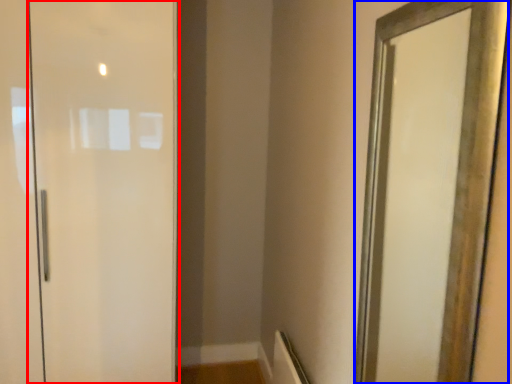
Question: Which object is further to the camera taking this photo, door (highlighted by a red box) or mirror (highlighted by a blue box)?

Choices:
 (A) door
 (B) mirror

Answer: (A)